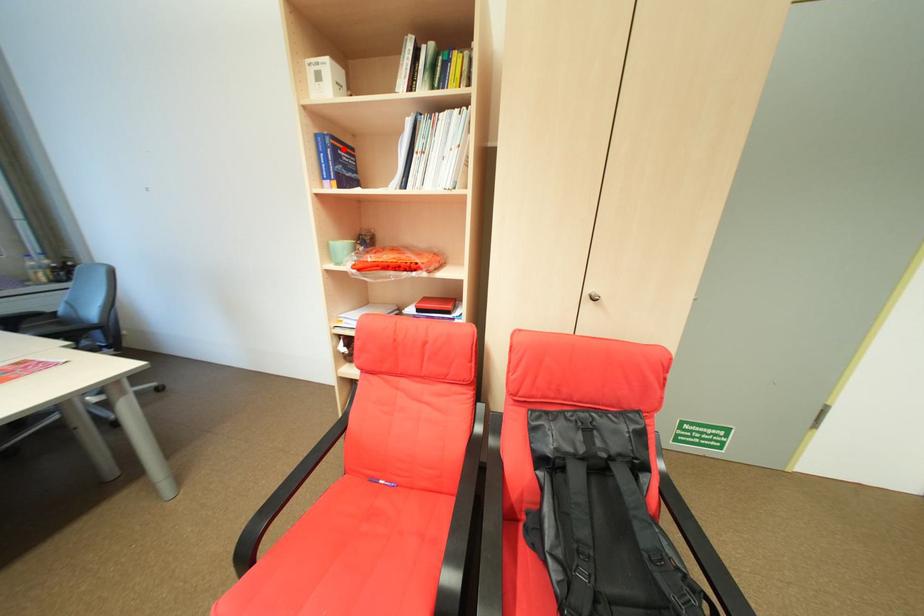
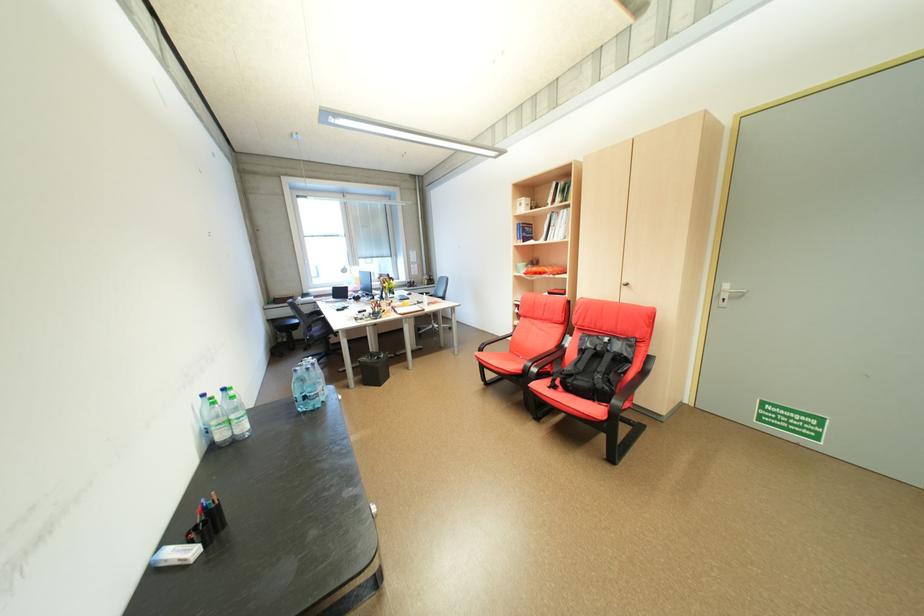
Where in the second image is the point corresponding to the highlighted location from the first image?

(532, 228)